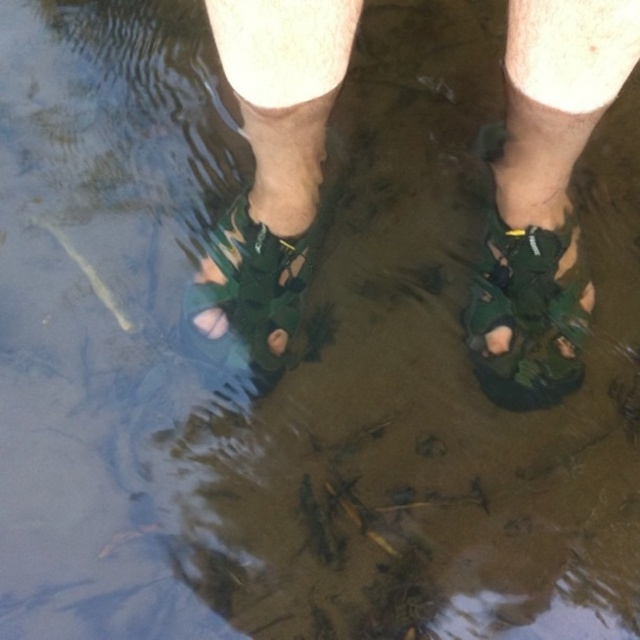
Question: Which object is the closest to the green fabric sock at center?

Choices:
 (A) green matte sandal at center
 (B) green fabric sandal at center
 (C) pink matte toe at center
 (D) matte green sandal at lower center

Answer: (B)

Question: Is matte green sandal at lower center in front of green matte sandal at center?

Choices:
 (A) no
 (B) yes

Answer: (B)

Question: Can you confirm if green mesh sandals at center is smaller than matte green sandal at lower center?

Choices:
 (A) yes
 (B) no

Answer: (B)

Question: Which is nearer to the matte green sandal at lower center?

Choices:
 (A) green matte sandal at center
 (B) green fabric sandal at center
 (C) green fabric sandal at lower right

Answer: (C)

Question: Among these objects, which one is nearest to the camera?

Choices:
 (A) matte green sandal at lower center
 (B) green fabric sock at center
 (C) green fabric sandal at center
 (D) green fabric sandal at lower right

Answer: (B)

Question: In this image, where is green fabric sandal at lower right located relative to green fabric sock at center?

Choices:
 (A) left
 (B) right

Answer: (B)